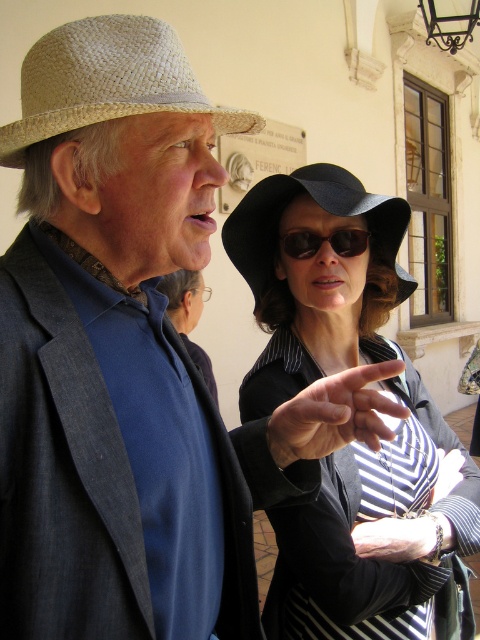
Is point (66, 49) positioned before point (276, 195)?

Yes.

Is natural straw hat at upper left smaller than matte straw hat at center?

Yes.

Does point (97, 74) lie in front of point (286, 320)?

Yes, it is in front of point (286, 320).

This screenshot has height=640, width=480. Find the location of `natural straw hat at upper left`. natural straw hat at upper left is located at coordinates (108, 81).

Does black felt hat at center appear on the right side of sunglasses at center?

Correct, you'll find black felt hat at center to the right of sunglasses at center.

Which of these two, black felt hat at center or sunglasses at center, stands shorter?

With less height is sunglasses at center.

Find the location of `black felt hat at center`. black felt hat at center is located at coordinates (355, 440).

How distant is natural straw hat at upper left from sunglasses at center?

natural straw hat at upper left and sunglasses at center are 28.34 inches apart.

Who is positioned more to the left, natural straw hat at upper left or sunglasses at center?

Positioned to the left is natural straw hat at upper left.

Between point (111, 38) and point (339, 253), which one is positioned behind?

The point (339, 253) is behind.

Locate an element on the screen. natural straw hat at upper left is located at coordinates (108, 81).